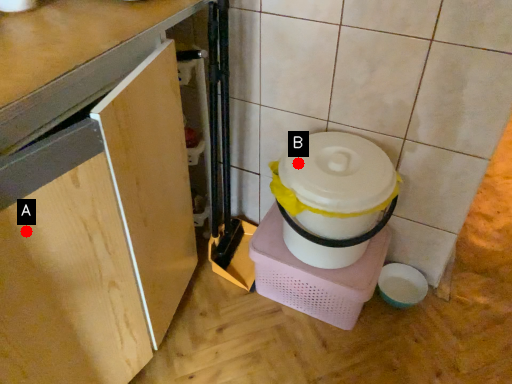
Question: Two points are circled on the image, labeled by A and B beside each circle. Which of the following is the farthest from the observer?

Choices:
 (A) A is further
 (B) B is further

Answer: (B)